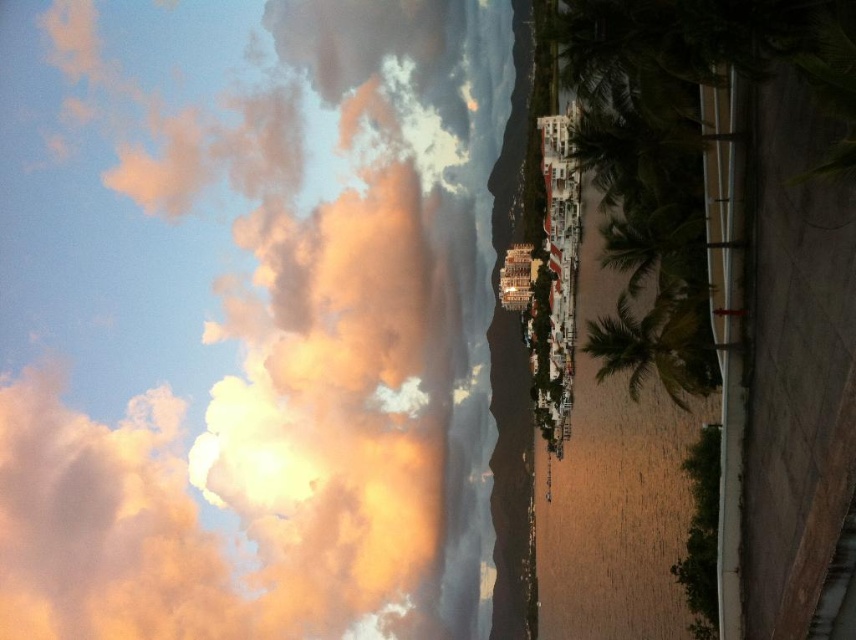
You are standing on the paved walkway near the palm trees and want to take a photo of both the point at coordinates point (609, 358) and the point at coordinates point (663, 234). Which point should you focus on first to ensure both are in the frame?

You should focus on point (609, 358) first because it is closer to you than point (663, 234), ensuring both points remain within the camera frame.